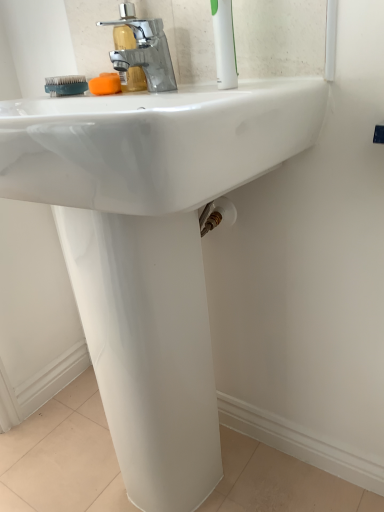
Question: Should I look upward or downward to see orange sponge at upper center?

Choices:
 (A) down
 (B) up

Answer: (B)

Question: Considering the relative sizes of white plastic toothbrush at upper right and polished chrome faucet at upper center in the image provided, is white plastic toothbrush at upper right shorter than polished chrome faucet at upper center?

Choices:
 (A) no
 (B) yes

Answer: (A)

Question: Is white plastic toothbrush at upper right aimed at polished chrome faucet at upper center?

Choices:
 (A) yes
 (B) no

Answer: (B)

Question: From a real-world perspective, is white plastic toothbrush at upper right under polished chrome faucet at upper center?

Choices:
 (A) no
 (B) yes

Answer: (A)

Question: Is white plastic toothbrush at upper right at the right side of polished chrome faucet at upper center?

Choices:
 (A) no
 (B) yes

Answer: (B)

Question: Is white plastic toothbrush at upper right thinner than polished chrome faucet at upper center?

Choices:
 (A) yes
 (B) no

Answer: (A)

Question: Is white plastic toothbrush at upper right facing away from polished chrome faucet at upper center?

Choices:
 (A) yes
 (B) no

Answer: (B)

Question: Considering the relative sizes of orange sponge at upper center and white plastic toothbrush at upper right in the image provided, is orange sponge at upper center shorter than white plastic toothbrush at upper right?

Choices:
 (A) yes
 (B) no

Answer: (A)

Question: From the image's perspective, is orange sponge at upper center over white plastic toothbrush at upper right?

Choices:
 (A) no
 (B) yes

Answer: (A)

Question: Is orange sponge at upper center positioned before white plastic toothbrush at upper right?

Choices:
 (A) no
 (B) yes

Answer: (A)

Question: Considering the relative sizes of orange sponge at upper center and white plastic toothbrush at upper right in the image provided, is orange sponge at upper center smaller than white plastic toothbrush at upper right?

Choices:
 (A) yes
 (B) no

Answer: (A)

Question: Would you consider orange sponge at upper center to be distant from white plastic toothbrush at upper right?

Choices:
 (A) yes
 (B) no

Answer: (B)

Question: Is the position of orange sponge at upper center more distant than that of white plastic toothbrush at upper right?

Choices:
 (A) no
 (B) yes

Answer: (B)

Question: Can you confirm if orange sponge at upper center is taller than polished chrome faucet at upper center?

Choices:
 (A) yes
 (B) no

Answer: (B)